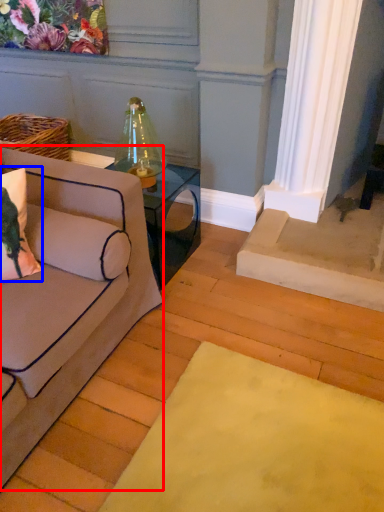
Question: Which object is closer to the camera taking this photo, studio couch (highlighted by a red box) or pillow (highlighted by a blue box)?

Choices:
 (A) studio couch
 (B) pillow

Answer: (A)